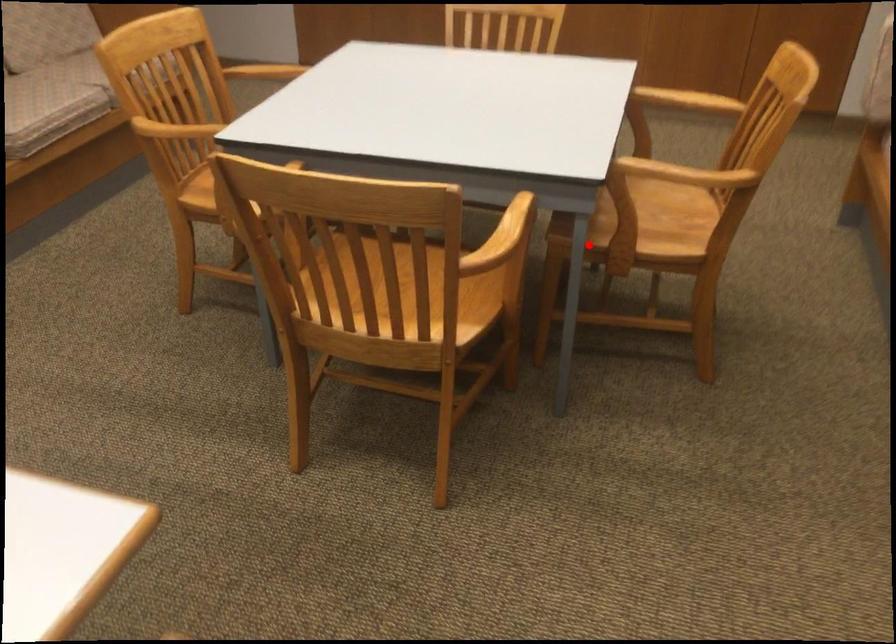
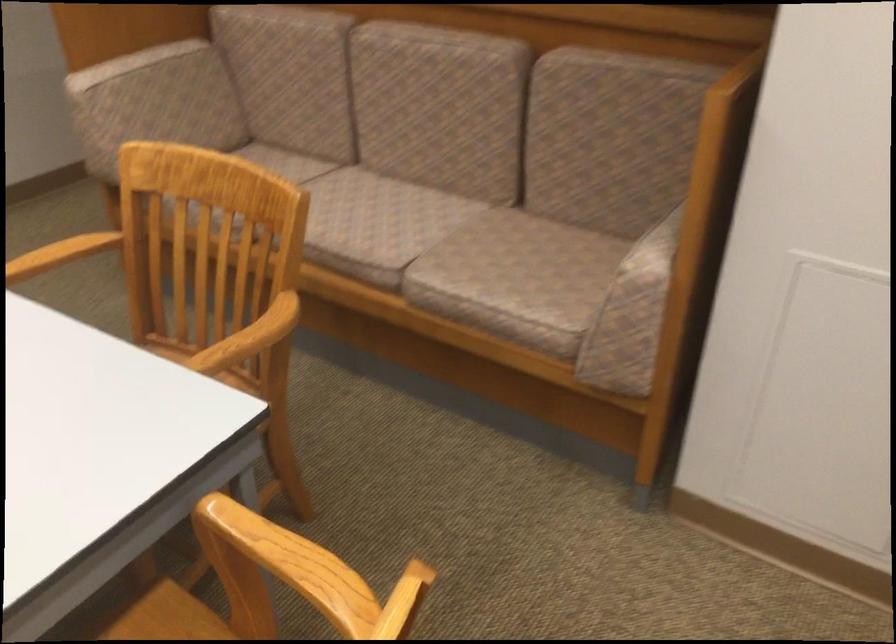
The point at the highlighted location is marked in the first image. Where is the corresponding point in the second image?

(259, 498)